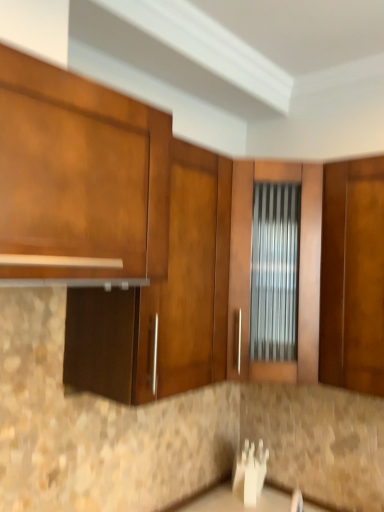
Question: Can you confirm if matte wood cabinet at upper left, placed as the 1th cabinetry when sorted from front to back, is shorter than matte wood cabinet at center, the 1th cabinetry positioned from the back?

Choices:
 (A) yes
 (B) no

Answer: (A)

Question: Is matte wood cabinet at upper left, placed as the 1th cabinetry when sorted from front to back, far from matte wood cabinet at center, the 1th cabinetry positioned from the back?

Choices:
 (A) yes
 (B) no

Answer: (B)

Question: Is matte wood cabinet at upper left, marked as the 2th cabinetry in a back-to-front arrangement, looking in the opposite direction of matte wood cabinet at center, which ranks as the second cabinetry in front-to-back order?

Choices:
 (A) yes
 (B) no

Answer: (B)

Question: Would you say matte wood cabinet at upper left, marked as the 2th cabinetry in a back-to-front arrangement, contains matte wood cabinet at center, which ranks as the second cabinetry in front-to-back order?

Choices:
 (A) no
 (B) yes

Answer: (A)

Question: Is matte wood cabinet at upper left, marked as the 2th cabinetry in a back-to-front arrangement, to the right of matte wood cabinet at center, which ranks as the second cabinetry in front-to-back order, from the viewer's perspective?

Choices:
 (A) no
 (B) yes

Answer: (A)

Question: Considering the relative positions of matte wood cabinet at upper left, placed as the 1th cabinetry when sorted from front to back, and matte wood cabinet at center, which ranks as the second cabinetry in front-to-back order, in the image provided, is matte wood cabinet at upper left, placed as the 1th cabinetry when sorted from front to back, behind matte wood cabinet at center, which ranks as the second cabinetry in front-to-back order,?

Choices:
 (A) yes
 (B) no

Answer: (B)

Question: Is matte wood cabinet at center, which ranks as the second cabinetry in front-to-back order, placed right next to matte wood cabinet at upper left, marked as the 2th cabinetry in a back-to-front arrangement?

Choices:
 (A) no
 (B) yes

Answer: (A)

Question: Considering the relative sizes of matte wood cabinet at center, which ranks as the second cabinetry in front-to-back order, and matte wood cabinet at upper left, placed as the 1th cabinetry when sorted from front to back, in the image provided, is matte wood cabinet at center, which ranks as the second cabinetry in front-to-back order, bigger than matte wood cabinet at upper left, placed as the 1th cabinetry when sorted from front to back,?

Choices:
 (A) yes
 (B) no

Answer: (A)

Question: Does matte wood cabinet at center, which ranks as the second cabinetry in front-to-back order, have a greater height compared to matte wood cabinet at upper left, marked as the 2th cabinetry in a back-to-front arrangement?

Choices:
 (A) yes
 (B) no

Answer: (A)

Question: Is matte wood cabinet at center, which ranks as the second cabinetry in front-to-back order, positioned with its back to matte wood cabinet at upper left, marked as the 2th cabinetry in a back-to-front arrangement?

Choices:
 (A) yes
 (B) no

Answer: (B)

Question: Is matte wood cabinet at center, which ranks as the second cabinetry in front-to-back order, positioned beyond the bounds of matte wood cabinet at upper left, marked as the 2th cabinetry in a back-to-front arrangement?

Choices:
 (A) yes
 (B) no

Answer: (A)

Question: From a real-world perspective, is matte wood cabinet at center, which ranks as the second cabinetry in front-to-back order, physically above matte wood cabinet at upper left, marked as the 2th cabinetry in a back-to-front arrangement?

Choices:
 (A) yes
 (B) no

Answer: (B)

Question: From the image's perspective, is matte wood cabinet at center, which ranks as the second cabinetry in front-to-back order, located above or below matte wood cabinet at upper left, marked as the 2th cabinetry in a back-to-front arrangement?

Choices:
 (A) above
 (B) below

Answer: (B)